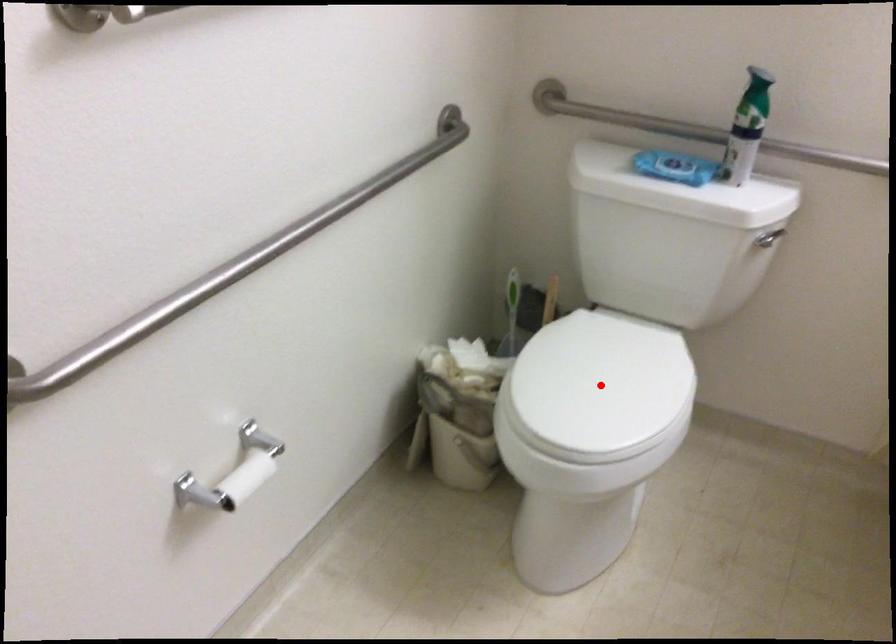
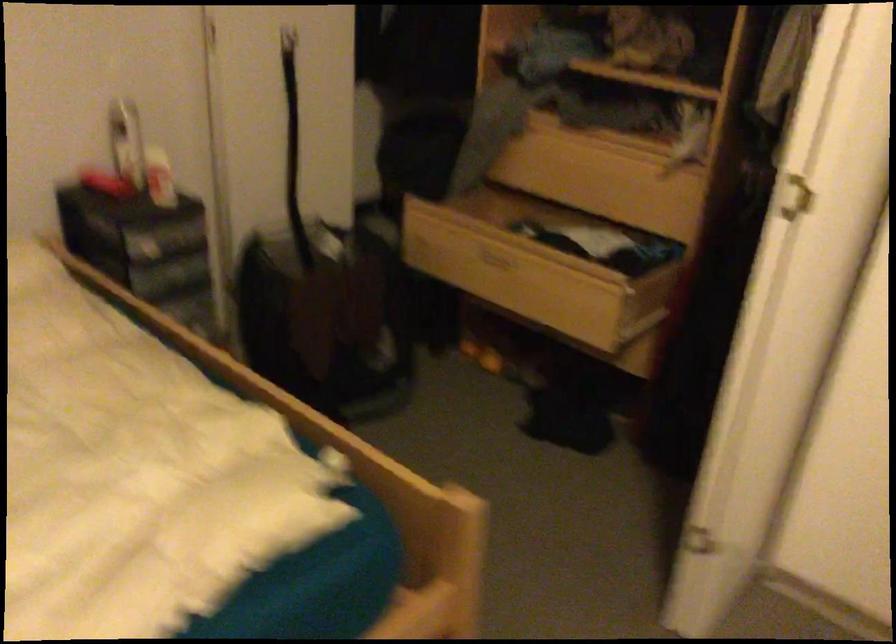
Question: I am providing you with two images of the same scene from different viewpoints. A red point is marked on the first image. Can you still see the location of the red point in image 2?

Choices:
 (A) Yes
 (B) No

Answer: (B)